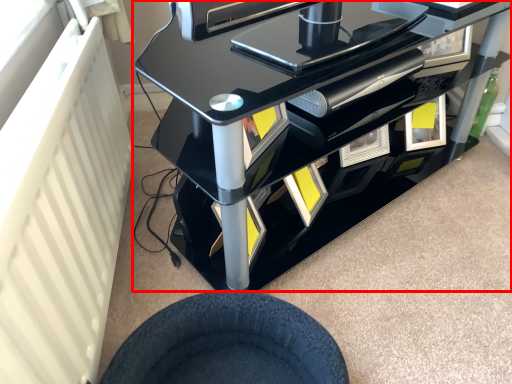
Question: Where is furniture (annotated by the red box) located in relation to wheel in the image?

Choices:
 (A) right
 (B) left

Answer: (A)